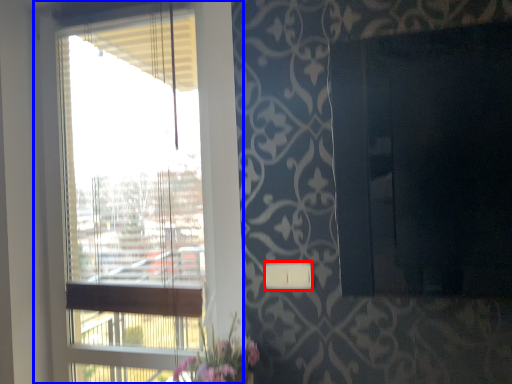
Question: Among these objects, which one is farthest to the camera, light switch (highlighted by a red box) or window (highlighted by a blue box)?

Choices:
 (A) light switch
 (B) window

Answer: (B)